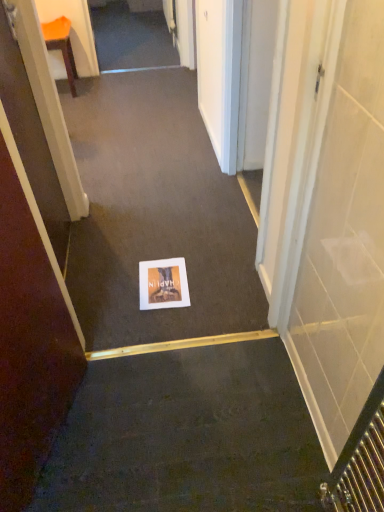
Describe the element at coordinates (61, 46) in the screenshot. The width and height of the screenshot is (384, 512). I see `orange plastic chair at upper left` at that location.

Image resolution: width=384 pixels, height=512 pixels. Describe the element at coordinates (30, 289) in the screenshot. I see `brown matte door at lower left` at that location.

Find the location of a particular element. This screenshot has width=384, height=512. white paper at center is located at coordinates (155, 213).

This screenshot has width=384, height=512. I want to click on orange plastic chair at upper left, so click(x=61, y=46).

Looking at this image, is orange plastic chair at upper left not near white paper at center?

Yes, orange plastic chair at upper left is far from white paper at center.

This screenshot has width=384, height=512. In order to click on path that appears in front of the orange plastic chair at upper left in this screenshot , I will do `click(155, 213)`.

From a real-world perspective, relative to white paper at center, is orange plastic chair at upper left vertically above or below?

orange plastic chair at upper left is above white paper at center.

From the picture: Who is shorter, orange plastic chair at upper left or white paper at center?

With less height is white paper at center.

Is brown matte door at lower left at the back of orange plastic chair at upper left?

No, orange plastic chair at upper left's orientation is not away from brown matte door at lower left.

In terms of height, does orange plastic chair at upper left look taller or shorter compared to brown matte door at lower left?

orange plastic chair at upper left is shorter than brown matte door at lower left.

Can you confirm if orange plastic chair at upper left is thinner than brown matte door at lower left?

No.

This screenshot has width=384, height=512. In order to click on door on the right of orange plastic chair at upper left in this screenshot , I will do `click(30, 289)`.

Is brown matte door at lower left thinner than orange plastic chair at upper left?

Yes.

Which is in front, point (36, 159) or point (67, 57)?

The point (36, 159) is in front.

From a real-world perspective, which object stands above the other?

brown matte door at lower left.

Looking at this image, from a real-world perspective, does white paper at center stand above orange plastic chair at upper left?

No, from a real-world perspective, white paper at center is not over orange plastic chair at upper left

Considering the sizes of objects white paper at center and orange plastic chair at upper left in the image provided, who is taller, white paper at center or orange plastic chair at upper left?

Standing taller between the two is orange plastic chair at upper left.

Considering the sizes of white paper at center and orange plastic chair at upper left in the image, is white paper at center wider or thinner than orange plastic chair at upper left?

In the image, white paper at center appears to be wider than orange plastic chair at upper left.

From the picture: Between white paper at center and orange plastic chair at upper left, which one appears on the left side from the viewer's perspective?

From the viewer's perspective, orange plastic chair at upper left appears more on the left side.

Can you tell me how much orange plastic chair at upper left and matte paper postcard at center differ in facing direction?

178 degrees.

From the image's perspective, is orange plastic chair at upper left above or below matte paper postcard at center?

Clearly, from the image's perspective, orange plastic chair at upper left is above matte paper postcard at center.

Is point (64, 57) positioned in front of point (183, 262)?

No.

Is orange plastic chair at upper left wider or thinner than matte paper postcard at center?

In the image, orange plastic chair at upper left appears to be wider than matte paper postcard at center.

Is matte paper postcard at center inside the boundaries of brown matte door at lower left, or outside?

matte paper postcard at center is not inside brown matte door at lower left, it's outside.

Can you confirm if matte paper postcard at center is taller than brown matte door at lower left?

No, matte paper postcard at center is not taller than brown matte door at lower left.

Does matte paper postcard at center touch brown matte door at lower left?

No, matte paper postcard at center is not touching brown matte door at lower left.

How far apart are matte paper postcard at center and brown matte door at lower left?

The distance of matte paper postcard at center from brown matte door at lower left is 22.55 inches.

Considering the sizes of objects matte paper postcard at center and orange plastic chair at upper left in the image provided, who is bigger, matte paper postcard at center or orange plastic chair at upper left?

orange plastic chair at upper left.

Would you say matte paper postcard at center is inside or outside orange plastic chair at upper left?

matte paper postcard at center is not enclosed by orange plastic chair at upper left.

Is matte paper postcard at center far away from orange plastic chair at upper left?

Yes, matte paper postcard at center and orange plastic chair at upper left are quite far apart.

You are a GUI agent. You are given a task and a screenshot of the screen. Output one action in this format:
    pyautogui.click(x=<x>, y=<y>)
    Task: Click on the furniture that is on the left side of matte paper postcard at center
    
    Given the screenshot: What is the action you would take?
    pyautogui.click(x=61, y=46)

The height and width of the screenshot is (512, 384). Find the location of `path in front of the orange plastic chair at upper left`. path in front of the orange plastic chair at upper left is located at coordinates (155, 213).

This screenshot has height=512, width=384. I want to click on furniture below the brown matte door at lower left (from a real-world perspective), so click(x=61, y=46).

When comparing their distances from white paper at center, does orange plastic chair at upper left or matte paper postcard at center seem closer?

Result: Among the two, matte paper postcard at center is located nearer to white paper at center.

Looking at the image, which one is located further to brown matte door at lower left, matte paper postcard at center or orange plastic chair at upper left?

The object further to brown matte door at lower left is orange plastic chair at upper left.

Estimate the real-world distances between objects in this image. Which object is further from orange plastic chair at upper left, brown matte door at lower left or matte paper postcard at center?

The object further to orange plastic chair at upper left is brown matte door at lower left.

Looking at this image, considering their positions, is orange plastic chair at upper left positioned closer to brown matte door at lower left than matte paper postcard at center?

matte paper postcard at center is positioned closer to the anchor brown matte door at lower left.

Considering their positions, is matte paper postcard at center positioned further to orange plastic chair at upper left than brown matte door at lower left?

brown matte door at lower left is positioned further to the anchor orange plastic chair at upper left.

Looking at this image, from the image, which object appears to be farther from matte paper postcard at center, orange plastic chair at upper left or brown matte door at lower left?

orange plastic chair at upper left lies further to matte paper postcard at center than the other object.

Based on their spatial positions, is matte paper postcard at center or white paper at center closer to brown matte door at lower left?

matte paper postcard at center is positioned closer to the anchor brown matte door at lower left.

Looking at the image, which one is located closer to matte paper postcard at center, brown matte door at lower left or white paper at center?

white paper at center lies closer to matte paper postcard at center than the other object.

The height and width of the screenshot is (512, 384). I want to click on postcard between brown matte door at lower left and orange plastic chair at upper left in the front-back direction, so click(x=163, y=284).

Where is `path positioned between brown matte door at lower left and matte paper postcard at center from near to far`? The image size is (384, 512). path positioned between brown matte door at lower left and matte paper postcard at center from near to far is located at coordinates (155, 213).

The height and width of the screenshot is (512, 384). What are the coordinates of `path between brown matte door at lower left and orange plastic chair at upper left in the front-back direction` in the screenshot? It's located at (155, 213).

Locate an element on the screen. The height and width of the screenshot is (512, 384). path between orange plastic chair at upper left and matte paper postcard at center in the vertical direction is located at coordinates (155, 213).